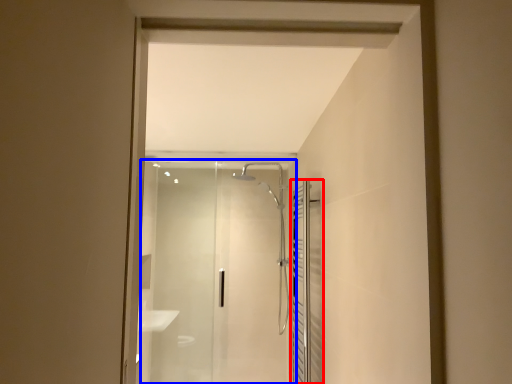
Question: Which of the following is the closest to the observer, screen door (highlighted by a red box) or screen door (highlighted by a blue box)?

Choices:
 (A) screen door
 (B) screen door

Answer: (A)